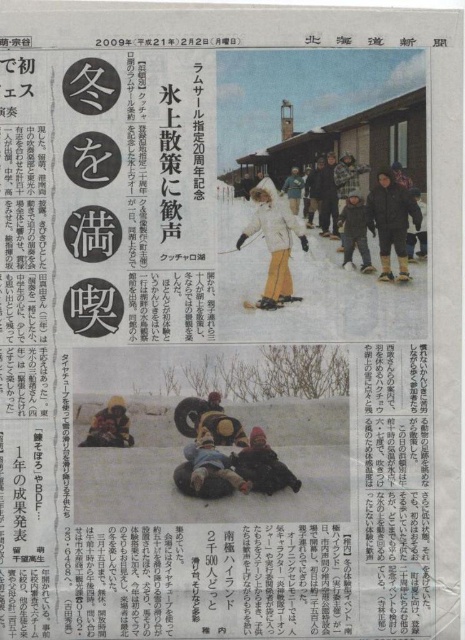
You are a photographer trying to capture a clear shot of the two items at the center of the top photograph in the newspaper. The white matte jacket at center and the yellow fuzzy hat at center are both in your frame. Since you want to ensure both are visible, which item should you focus on first to account for their sizes?

The white matte jacket at center is bigger than the yellow fuzzy hat at center, so you should focus on the white matte jacket at center first to ensure it is in clear view before adjusting for the smaller yellow fuzzy hat at center.

You are looking at the newspaper page and want to determine the relative positions of two points marked on the image. Which of the two points, point (264, 486) or point (99, 416), is closer to you?

Point (264, 486) is closer to you because it is further to the viewer than point (99, 416).